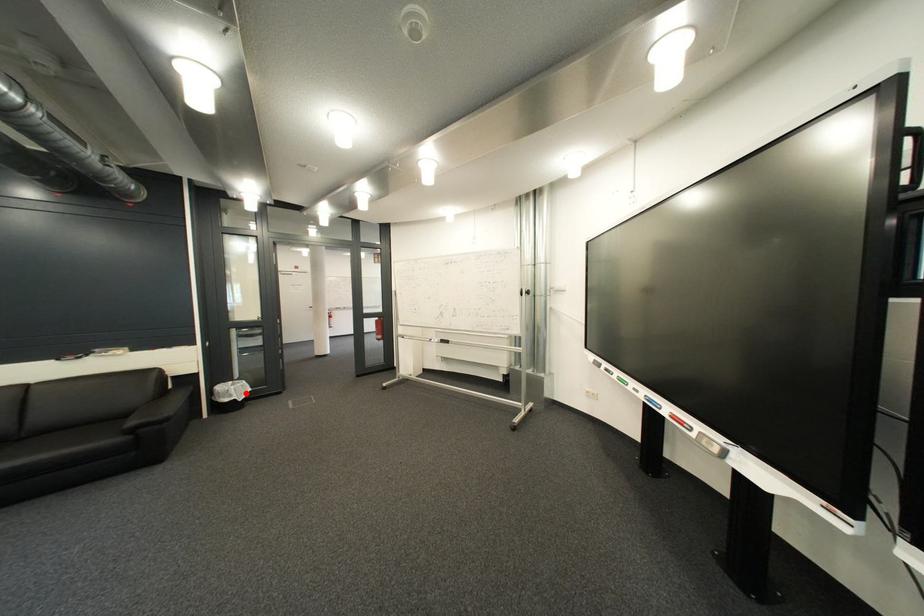
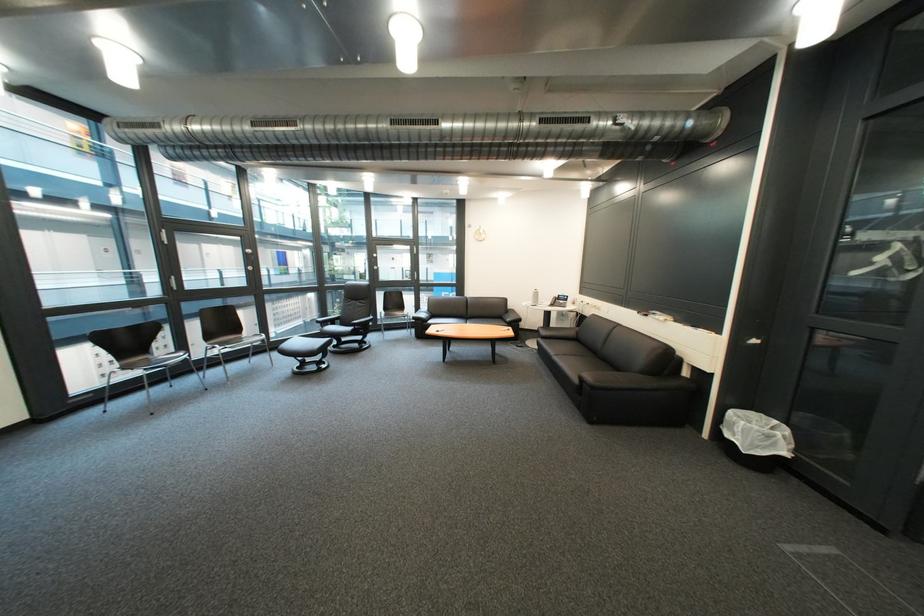
Where in the second image is the point corresponding to the highlighted location from the first image?

(751, 431)